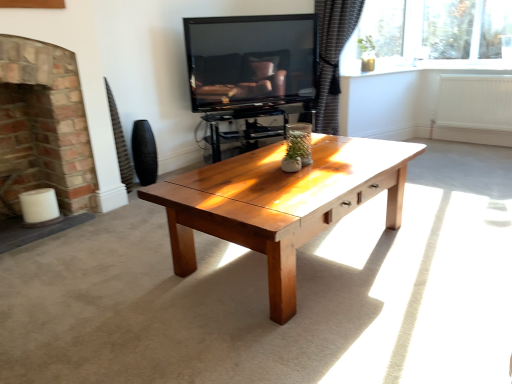
Question: Considering the positions of point (510, 109) and point (332, 92), is point (510, 109) closer or farther from the camera than point (332, 92)?

Choices:
 (A) farther
 (B) closer

Answer: (B)

Question: Looking at the image, does white painted radiator at right seem bigger or smaller compared to dark textured curtain at upper right?

Choices:
 (A) small
 (B) big

Answer: (A)

Question: Considering the real-world distances, which object is closest to the black matte vase at left?

Choices:
 (A) dark textured curtain at upper right
 (B) white painted radiator at right
 (C) brick fireplace at left
 (D) matte black tv at upper center

Answer: (C)

Question: Which of these objects is positioned farthest from the brick fireplace at left?

Choices:
 (A) dark textured curtain at upper right
 (B) black matte vase at left
 (C) matte black tv at upper center
 (D) white painted radiator at right

Answer: (D)